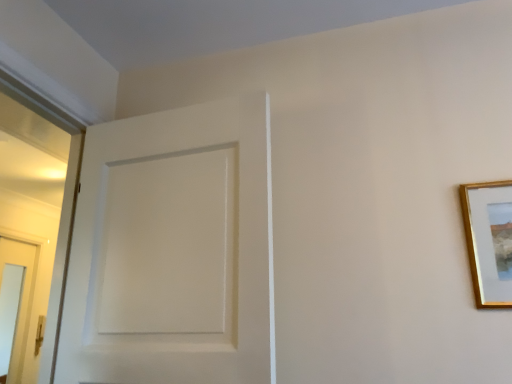
In order to click on gold wooden picture frame at upper right in this screenshot , I will do `click(489, 240)`.

This screenshot has width=512, height=384. What do you see at coordinates (489, 240) in the screenshot?
I see `gold wooden picture frame at upper right` at bounding box center [489, 240].

This screenshot has width=512, height=384. What do you see at coordinates (173, 250) in the screenshot?
I see `white matte door at center` at bounding box center [173, 250].

The height and width of the screenshot is (384, 512). Identify the location of white matte door at center. (173, 250).

I want to click on gold wooden picture frame at upper right, so click(489, 240).

In the scene shown: Considering the positions of objects gold wooden picture frame at upper right and white matte door at center in the image provided, who is more to the left, gold wooden picture frame at upper right or white matte door at center?

white matte door at center.

In the scene shown: Who is more distant, gold wooden picture frame at upper right or white matte door at center?

gold wooden picture frame at upper right.

Does point (502, 207) appear closer or farther from the camera than point (181, 189)?

Clearly, point (502, 207) is closer to the camera than point (181, 189).

From the image's perspective, is gold wooden picture frame at upper right above white matte door at center?

Incorrect, from the image's perspective, gold wooden picture frame at upper right is lower than white matte door at center.

From a real-world perspective, between gold wooden picture frame at upper right and white matte door at center, who is vertically lower?

From a 3D spatial view, gold wooden picture frame at upper right is below.

Can you confirm if gold wooden picture frame at upper right is wider than white matte door at center?

In fact, gold wooden picture frame at upper right might be narrower than white matte door at center.

Considering the relative sizes of gold wooden picture frame at upper right and white matte door at center in the image provided, is gold wooden picture frame at upper right taller than white matte door at center?

In fact, gold wooden picture frame at upper right may be shorter than white matte door at center.

Looking at the image, does gold wooden picture frame at upper right seem bigger or smaller compared to white matte door at center?

gold wooden picture frame at upper right is smaller than white matte door at center.

Would you say gold wooden picture frame at upper right contains white matte door at center?

No, gold wooden picture frame at upper right does not contain white matte door at center.

Are gold wooden picture frame at upper right and white matte door at center far apart?

That's not correct — gold wooden picture frame at upper right is a little close to white matte door at center.

Is gold wooden picture frame at upper right looking in the opposite direction of white matte door at center?

No, gold wooden picture frame at upper right is not facing away from white matte door at center.

What's the angular difference between gold wooden picture frame at upper right and white matte door at center's facing directions?

The angular difference between gold wooden picture frame at upper right and white matte door at center is 3.01 degrees.

Identify the location of picture frame on the right of white matte door at center. (489, 240).

Can you confirm if white matte door at center is positioned to the left of gold wooden picture frame at upper right?

Yes.

Is the position of white matte door at center more distant than that of gold wooden picture frame at upper right?

No, white matte door at center is closer to the viewer.

Which is behind, point (270, 206) or point (475, 243)?

The point (270, 206) is farther from the camera.

From the image's perspective, is white matte door at center located beneath gold wooden picture frame at upper right?

Incorrect, from the image's perspective, white matte door at center is higher than gold wooden picture frame at upper right.

From a real-world perspective, between white matte door at center and gold wooden picture frame at upper right, who is vertically higher?

From a 3D spatial view, white matte door at center is above.

From the picture: Considering the relative sizes of white matte door at center and gold wooden picture frame at upper right in the image provided, is white matte door at center thinner than gold wooden picture frame at upper right?

Incorrect, the width of white matte door at center is not less than that of gold wooden picture frame at upper right.

From their relative heights in the image, would you say white matte door at center is taller or shorter than gold wooden picture frame at upper right?

Considering their sizes, white matte door at center has more height than gold wooden picture frame at upper right.

Which of these two, white matte door at center or gold wooden picture frame at upper right, is bigger?

With larger size is white matte door at center.

Which is correct: white matte door at center is inside gold wooden picture frame at upper right, or outside of it?

white matte door at center is outside gold wooden picture frame at upper right.

Is white matte door at center next to gold wooden picture frame at upper right and touching it?

There is a gap between white matte door at center and gold wooden picture frame at upper right.

Does white matte door at center turn towards gold wooden picture frame at upper right?

No, white matte door at center is not oriented towards gold wooden picture frame at upper right.

How different are the orientations of white matte door at center and gold wooden picture frame at upper right in degrees?

3.01 degrees.

At what (x,y) coordinates should I click in order to perform the action: click on picture frame on the right of white matte door at center. Please return your answer as a coordinate pair (x, y). This screenshot has width=512, height=384. Looking at the image, I should click on (489, 240).

In order to click on door on the left of gold wooden picture frame at upper right in this screenshot , I will do `click(173, 250)`.

Identify the location of door above the gold wooden picture frame at upper right (from the image's perspective). (173, 250).